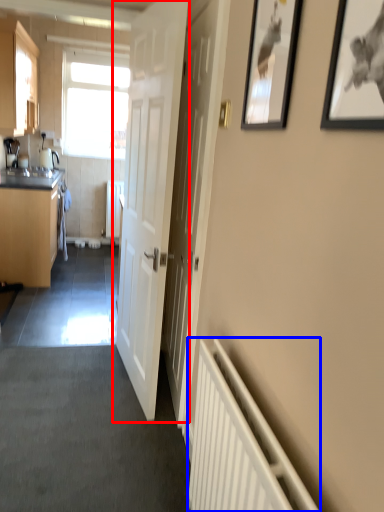
Question: Which point is further to the camera, door (highlighted by a red box) or radiator (highlighted by a blue box)?

Choices:
 (A) door
 (B) radiator

Answer: (A)